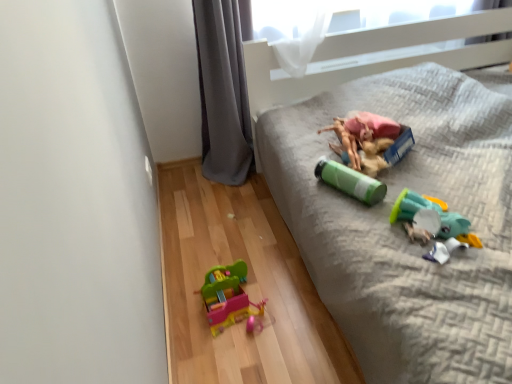
Question: Would you say multicolored plastic toy at lower center, the 4th toy positioned from the top, is inside or outside green matte water bottle at center, the 2th toy viewed from the top?

Choices:
 (A) inside
 (B) outside

Answer: (B)

Question: From the image's perspective, relative to green matte water bottle at center, positioned as the 3th toy in bottom-to-top order, is multicolored plastic toy at lower center, marked as the 1th toy in a bottom-to-top arrangement, above or below?

Choices:
 (A) above
 (B) below

Answer: (B)

Question: Which object is positioned closest to the gray fabric curtain at lower left?

Choices:
 (A) green matte water bottle at upper right
 (B) translucent plastic toy at lower right, the third toy in the top-to-bottom sequence
 (C) rubberized plastic toy at center, the first toy when ordered from top to bottom
 (D) green matte water bottle at center, positioned as the 3th toy in bottom-to-top order
 (E) multicolored plastic toy at lower center, marked as the 1th toy in a bottom-to-top arrangement

Answer: (A)

Question: Which is nearer to the translucent plastic toy at lower right, the third toy in the top-to-bottom sequence?

Choices:
 (A) gray fabric curtain at lower left
 (B) green matte water bottle at upper right
 (C) green matte water bottle at center, the 2th toy viewed from the top
 (D) rubberized plastic toy at center, the 4th toy in the bottom-to-top sequence
 (E) multicolored plastic toy at lower center, the 4th toy positioned from the top

Answer: (C)